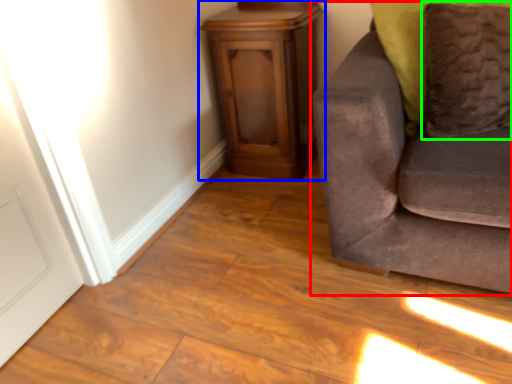
Question: Considering the real-world distances, which object is closest to studio couch (highlighted by a red box)? furniture (highlighted by a blue box) or pillow (highlighted by a green box).

Choices:
 (A) furniture
 (B) pillow

Answer: (B)